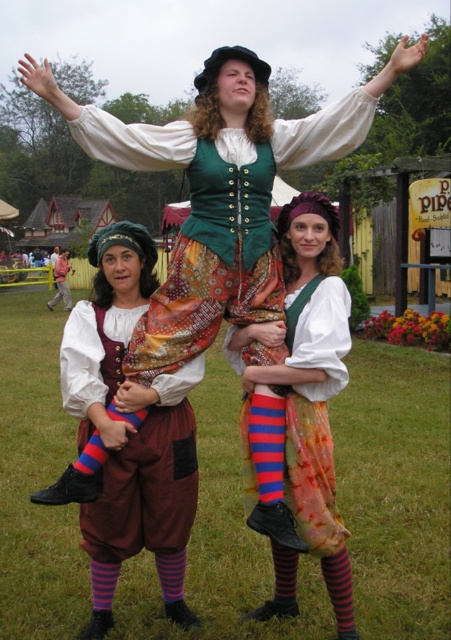
Question: Is matte brown leather skirt at center below matte white blouse at center?

Choices:
 (A) yes
 (B) no

Answer: (A)

Question: Which object is farther from the camera taking this photo?

Choices:
 (A) matte white blouse at center
 (B) matte green fabric vest at center
 (C) matte brown leather skirt at center

Answer: (C)

Question: Can you confirm if matte brown leather skirt at center is positioned below matte white blouse at center?

Choices:
 (A) yes
 (B) no

Answer: (A)

Question: Which object is farther from the camera taking this photo?

Choices:
 (A) matte brown leather belt at center
 (B) matte white blouse at center
 (C) matte brown leather skirt at center

Answer: (A)

Question: Considering the relative positions of matte white blouse at center and matte brown leather belt at center in the image provided, where is matte white blouse at center located with respect to matte brown leather belt at center?

Choices:
 (A) below
 (B) above

Answer: (A)

Question: Which object is the closest to the matte white blouse at center?

Choices:
 (A) matte brown leather skirt at center
 (B) matte green fabric vest at center

Answer: (A)